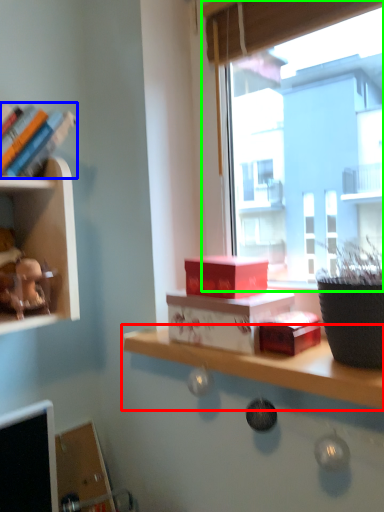
Question: Which object is positioned closest to shelf (highlighted by a red box)? Select from book (highlighted by a blue box) and window (highlighted by a green box).

Choices:
 (A) book
 (B) window

Answer: (A)